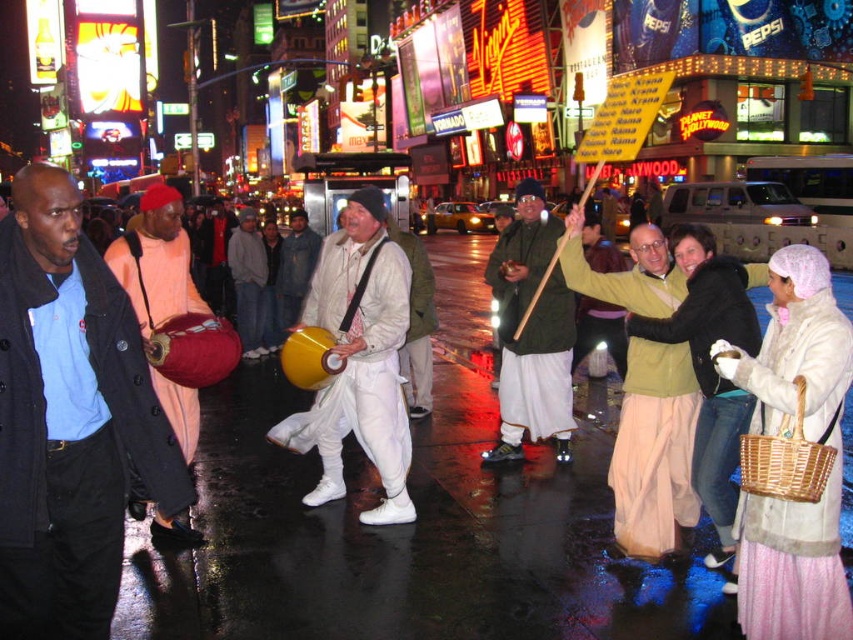
You are a photographer standing in the middle of the street. You want to take a photo of the white cotton pants at center and the matte peach drum at left. Which object should you focus on first if you want to capture both in the same frame without moving your camera?

The white cotton pants at center has a lesser height compared to matte peach drum at left, so you should focus on the matte peach drum at left first to ensure both objects are in focus.